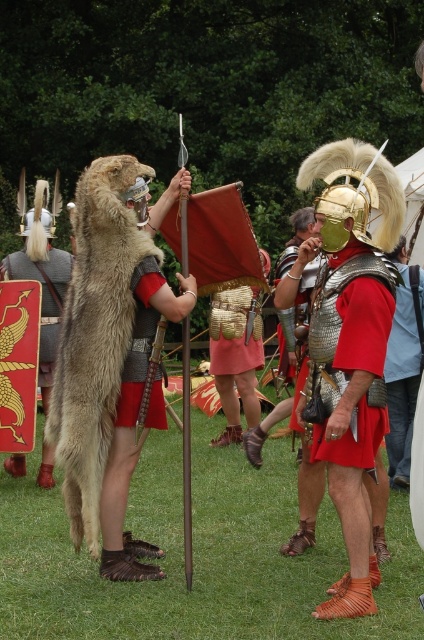
Question: Which of the following is the farthest from the observer?

Choices:
 (A) (398, 314)
 (B) (97, 516)
 (C) (365, 276)
 (D) (19, 266)

Answer: (D)

Question: Can you confirm if metallic chainmail armor at center is smaller than red fabric skirt at center?

Choices:
 (A) no
 (B) yes

Answer: (B)

Question: Does furry brown animal at center come in front of metallic chainmail armor at center?

Choices:
 (A) yes
 (B) no

Answer: (B)

Question: Which of the following is the closest to the observer?

Choices:
 (A) gold plated shield at center
 (B) metallic chainmail armor at center
 (C) red fabric skirt at center

Answer: (B)

Question: In this image, where is red fabric skirt at center located relative to gold plated shield at center?

Choices:
 (A) above
 (B) below

Answer: (B)

Question: Which point is closer to the camera taking this photo?

Choices:
 (A) (312, 448)
 (B) (77, 397)
 (C) (407, 324)

Answer: (B)